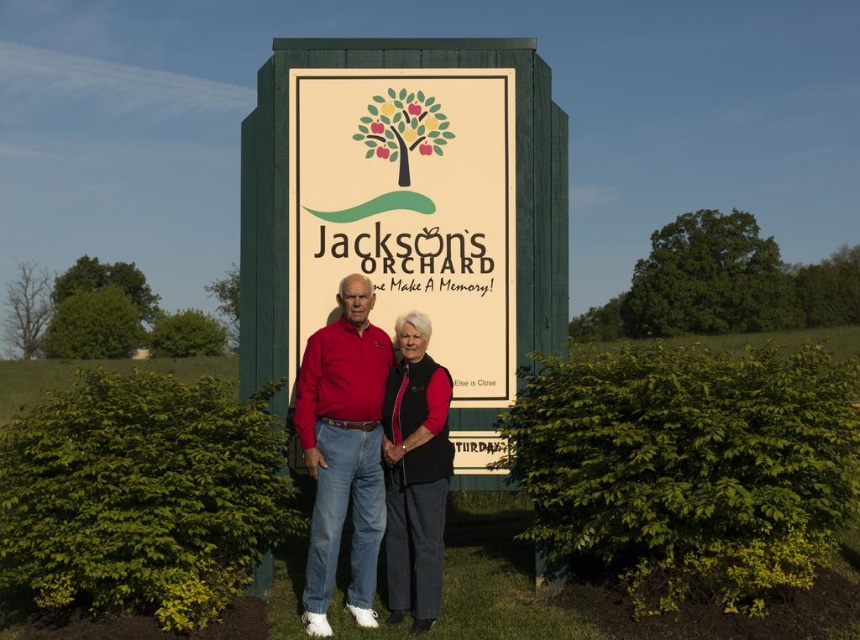
You are standing in front of Jacksons Orchard and want to take a photo of the matte green sign at center and the matte red shirt at center. Which object should you adjust to ensure both are in the frame?

The matte green sign at center is positioned on the right side of the matte red shirt at center. To ensure both are in the frame, you should adjust the matte red shirt at center to move it closer to the center or the matte green sign at center to move it towards the left so they are both within the camera frame.